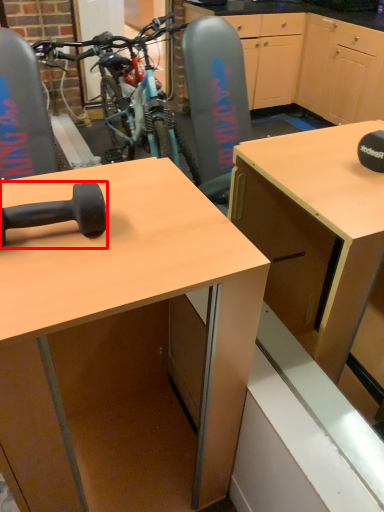
Question: In this image, where is dumbbell (annotated by the red box) located relative to desk?

Choices:
 (A) right
 (B) left

Answer: (B)